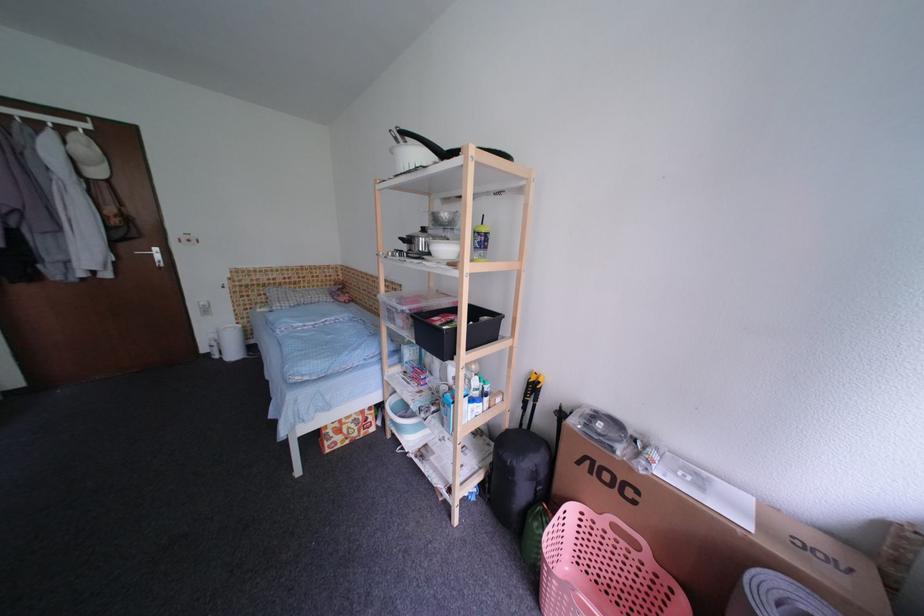
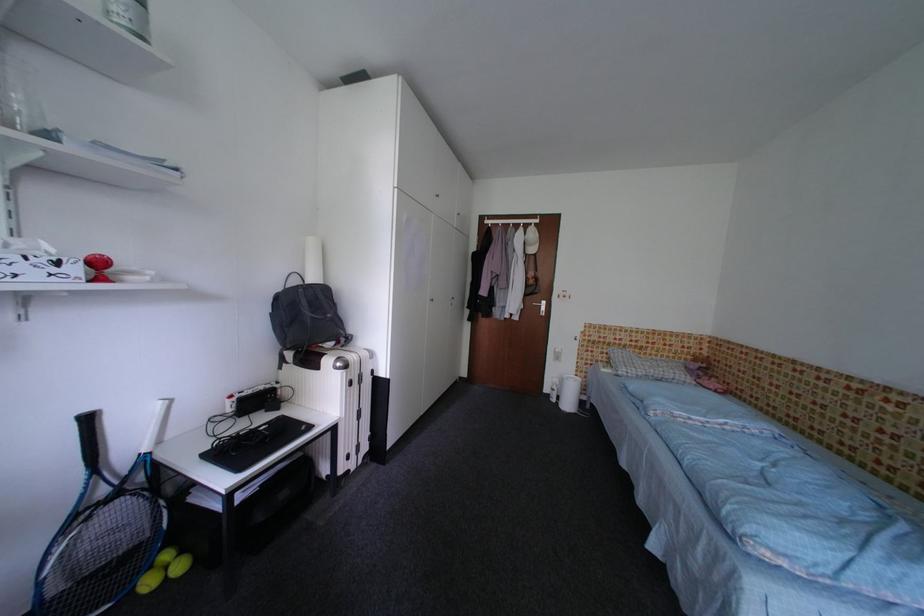
Locate, in the second image, the point that corresponds to point (58, 136) in the first image.

(529, 232)